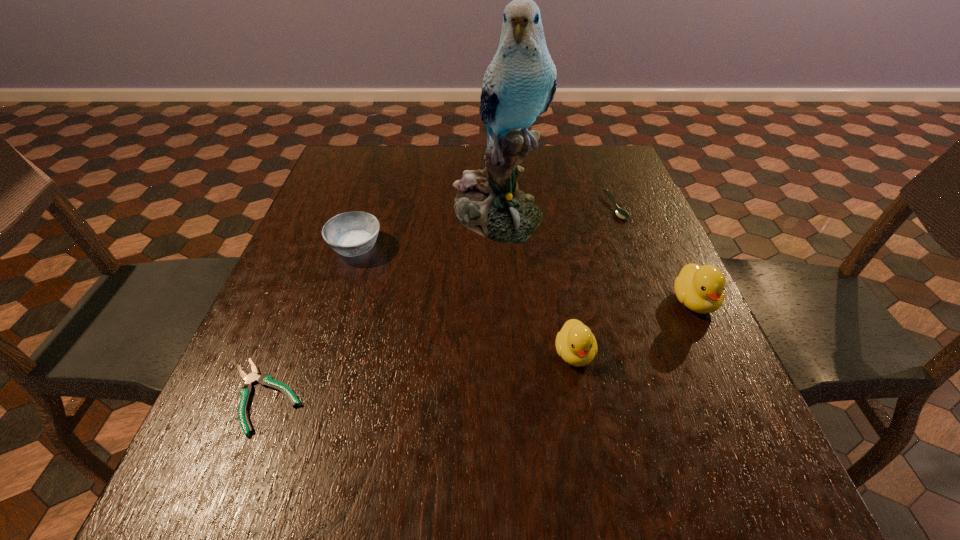
Select which object appears as the fourth closest to the fourth farthest object. Please provide its 2D coordinates. Your answer should be formatted as a tuple, i.e. [(x, y)], where the tuple contains the x and y coordinates of a point satisfying the conditions above.

[(354, 233)]

Identify the location of blank area in the image that satisfies the following two spatial constraints: 1. on the back side of the shortest object; 2. on the left side of the second object from right to left. pyautogui.click(x=339, y=207).